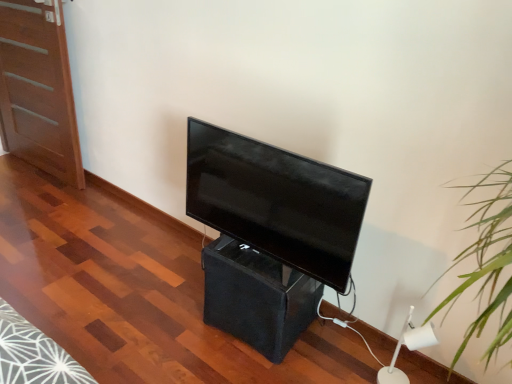
What are the coordinates of `free area in between white plastic lamp at lower right and matte wood door at left` in the screenshot? It's located at (158, 238).